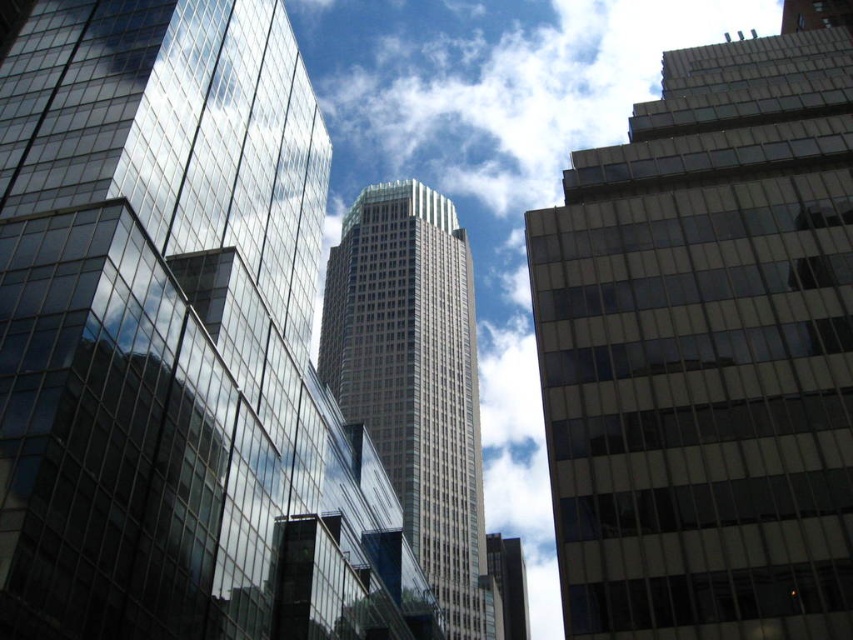
From the picture: You are an architect designing a new building in the city. You want to place a statue of a bird in the sky to symbolize freedom. The statue will be placed at coordinates point 0.261, 0.581. Will the statue overlap with the white fluffy cloud at center?

The white fluffy cloud at center is located at point (495, 166), so the statue will overlap with the white fluffy cloud at center.

You are an architect observing the cityscape. You notice the white fluffy cloud at center and the smooth glass skyscraper at center. Which object appears nearer to you in the image?

The white fluffy cloud at center appears closer to the viewer than the smooth glass skyscraper at center because it is positioned in front of the skyscraper.